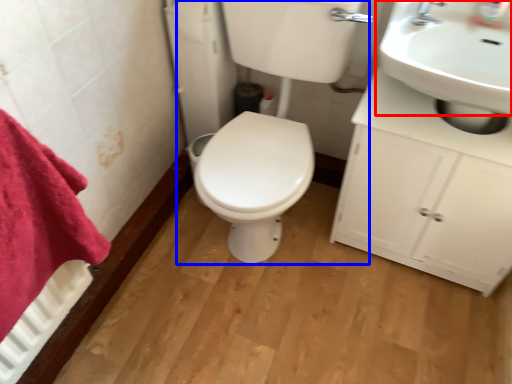
Question: Among these objects, which one is farthest to the camera, sink (highlighted by a red box) or porcelain (highlighted by a blue box)?

Choices:
 (A) sink
 (B) porcelain

Answer: (A)